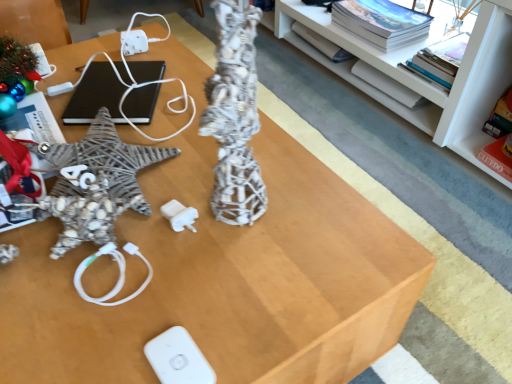
Question: Can you confirm if shiny metallic ornament at upper left is bigger than white glossy shelf at upper center?

Choices:
 (A) no
 (B) yes

Answer: (A)

Question: From the image's perspective, is shiny metallic ornament at upper left located beneath white glossy shelf at upper center?

Choices:
 (A) no
 (B) yes

Answer: (B)

Question: Can you confirm if shiny metallic ornament at upper left is positioned to the right of white glossy shelf at upper center?

Choices:
 (A) no
 (B) yes

Answer: (A)

Question: Considering the relative positions of shiny metallic ornament at upper left and white glossy shelf at upper center in the image provided, is shiny metallic ornament at upper left to the left of white glossy shelf at upper center from the viewer's perspective?

Choices:
 (A) yes
 (B) no

Answer: (A)

Question: Considering the relative sizes of shiny metallic ornament at upper left and white glossy shelf at upper center in the image provided, is shiny metallic ornament at upper left wider than white glossy shelf at upper center?

Choices:
 (A) no
 (B) yes

Answer: (A)

Question: Is shiny metallic ornament at upper left located outside white glossy shelf at upper center?

Choices:
 (A) no
 (B) yes

Answer: (B)

Question: From a real-world perspective, is white matte wii controller at lower center beneath black matte laptop at upper left?

Choices:
 (A) yes
 (B) no

Answer: (A)

Question: Is white matte wii controller at lower center far away from black matte laptop at upper left?

Choices:
 (A) no
 (B) yes

Answer: (A)

Question: Is black matte laptop at upper left at the back of white matte wii controller at lower center?

Choices:
 (A) yes
 (B) no

Answer: (B)

Question: From the image's perspective, does white matte wii controller at lower center appear higher than black matte laptop at upper left?

Choices:
 (A) no
 (B) yes

Answer: (A)

Question: Is white matte wii controller at lower center touching black matte laptop at upper left?

Choices:
 (A) yes
 (B) no

Answer: (B)

Question: Does white matte wii controller at lower center turn towards black matte laptop at upper left?

Choices:
 (A) no
 (B) yes

Answer: (A)

Question: From the image's perspective, is white glossy shelf at upper center on shiny metallic ornament at upper left?

Choices:
 (A) yes
 (B) no

Answer: (A)